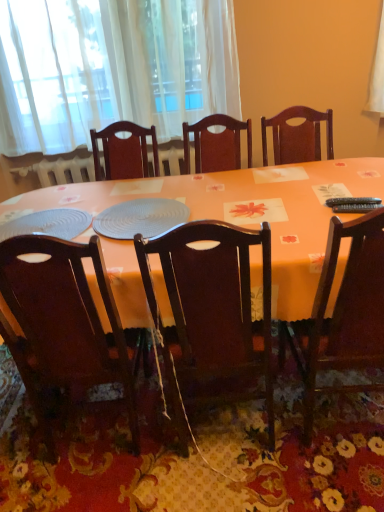
The image size is (384, 512). What are the coordinates of `free space to the back side of matte blue placemat at center` in the screenshot? It's located at click(148, 189).